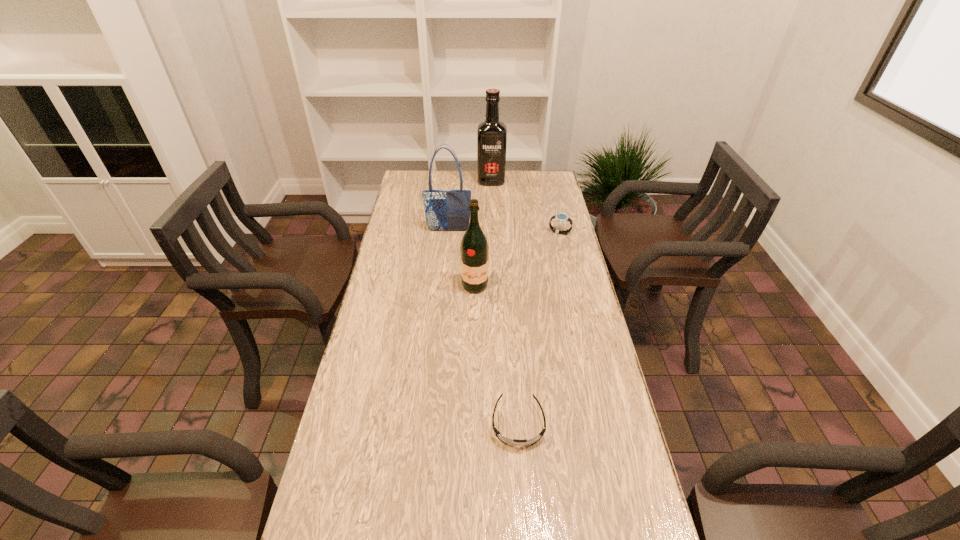
Find the location of a particular element. the farther liquor is located at coordinates (492, 134).

Locate an element on the screen. The width and height of the screenshot is (960, 540). the farthest object is located at coordinates (492, 134).

Identify the location of shopping bag. (445, 210).

At what (x,y) coordinates should I click in order to perform the action: click on the second nearest object. Please return your answer as a coordinate pair (x, y). The width and height of the screenshot is (960, 540). Looking at the image, I should click on (474, 250).

Locate an element on the screen. The height and width of the screenshot is (540, 960). the nearer liquor is located at coordinates (474, 250).

This screenshot has height=540, width=960. Identify the location of the rightmost object. (561, 218).

You are a GUI agent. You are given a task and a screenshot of the screen. Output one action in this format:
    pyautogui.click(x=<x>, y=<y>)
    Task: Click on the watch
    
    Given the screenshot: What is the action you would take?
    pyautogui.click(x=561, y=218)

The height and width of the screenshot is (540, 960). I want to click on the nearest object, so click(515, 442).

Locate an element on the screen. the shortest object is located at coordinates (515, 442).

The width and height of the screenshot is (960, 540). What are the coordinates of `free space located on the front-facing side of the farther liquor` in the screenshot? It's located at (492, 209).